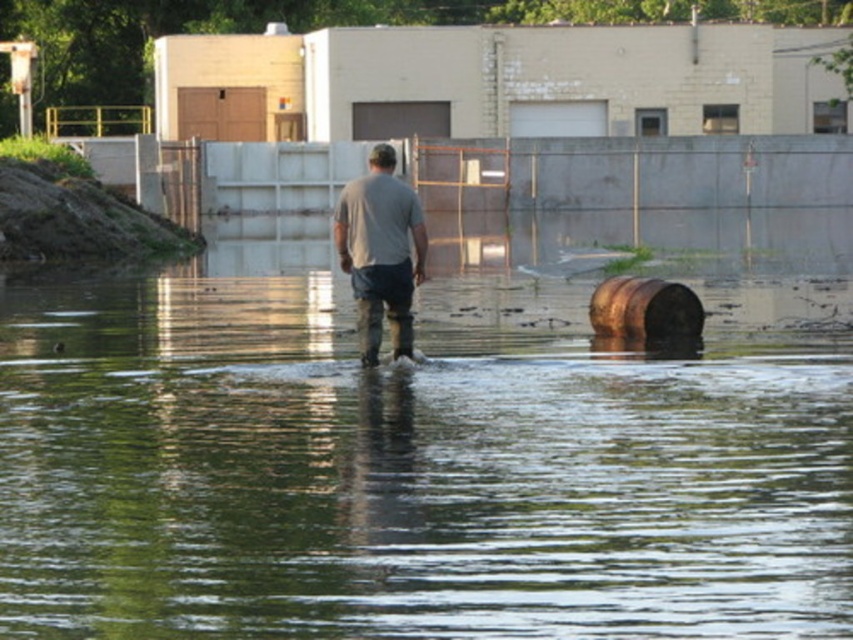
Question: Does clear water at center appear over gray matte shirt at center?

Choices:
 (A) yes
 (B) no

Answer: (B)

Question: Is clear water at center behind gray matte shirt at center?

Choices:
 (A) yes
 (B) no

Answer: (B)

Question: Is clear water at center closer to the viewer compared to gray matte shirt at center?

Choices:
 (A) no
 (B) yes

Answer: (B)